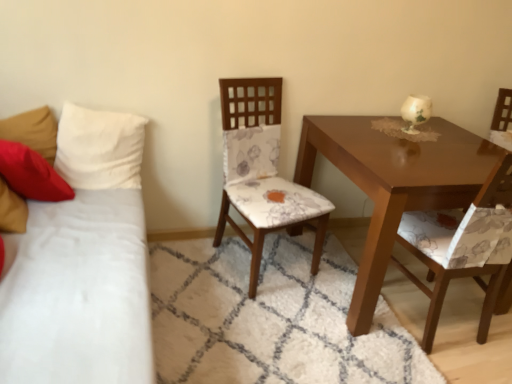
Question: Is floral fabric chair at right, which is the 2th chair from left to right, to the left of white fabric studio couch at left from the viewer's perspective?

Choices:
 (A) no
 (B) yes

Answer: (A)

Question: Is floral fabric chair at right, which ranks as the first chair in right-to-left order, next to white fabric studio couch at left?

Choices:
 (A) yes
 (B) no

Answer: (B)

Question: Is floral fabric chair at right, which is the 2th chair from left to right, bigger than white fabric studio couch at left?

Choices:
 (A) yes
 (B) no

Answer: (B)

Question: Is floral fabric chair at right, which is the 2th chair from left to right, at the right side of white fabric studio couch at left?

Choices:
 (A) yes
 (B) no

Answer: (A)

Question: Does floral fabric chair at right, which ranks as the first chair in right-to-left order, lie in front of white fabric studio couch at left?

Choices:
 (A) no
 (B) yes

Answer: (A)

Question: From a real-world perspective, does floral fabric chair at right, which is the 2th chair from left to right, sit lower than white fabric studio couch at left?

Choices:
 (A) no
 (B) yes

Answer: (A)

Question: Are white fabric studio couch at left and floral fabric chair at right, which ranks as the first chair in right-to-left order, far apart?

Choices:
 (A) no
 (B) yes

Answer: (B)

Question: Is floral fabric chair at right, which ranks as the first chair in right-to-left order, inside white fabric studio couch at left?

Choices:
 (A) yes
 (B) no

Answer: (B)

Question: Is white fabric studio couch at left smaller than floral fabric chair at right, which is the 2th chair from left to right?

Choices:
 (A) no
 (B) yes

Answer: (A)

Question: From the image's perspective, does white fabric studio couch at left appear higher than floral fabric chair at right, which ranks as the first chair in right-to-left order?

Choices:
 (A) yes
 (B) no

Answer: (B)

Question: From a real-world perspective, is white fabric studio couch at left below floral fabric chair at right, which ranks as the first chair in right-to-left order?

Choices:
 (A) no
 (B) yes

Answer: (B)

Question: Is white fabric studio couch at left aimed at floral fabric chair at right, which ranks as the first chair in right-to-left order?

Choices:
 (A) no
 (B) yes

Answer: (B)

Question: Considering the relative sizes of white fabric pillow at left, which is the 1th pillow in right-to-left order, and floral fabric chair at center, the first chair viewed from the left, in the image provided, is white fabric pillow at left, which is the 1th pillow in right-to-left order, bigger than floral fabric chair at center, the first chair viewed from the left,?

Choices:
 (A) no
 (B) yes

Answer: (A)